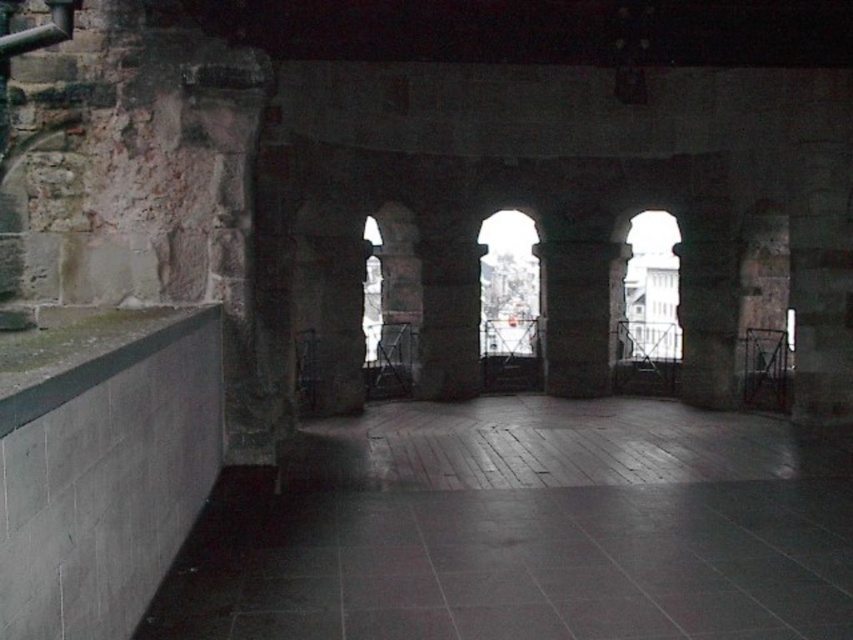
Question: Does dark gray tile floor at lower left have a lesser width compared to smooth stone pillar at center?

Choices:
 (A) no
 (B) yes

Answer: (A)

Question: Is dark gray tile floor at lower left wider than smooth stone pillar at center?

Choices:
 (A) yes
 (B) no

Answer: (A)

Question: Which object is closer to the camera taking this photo?

Choices:
 (A) dark gray tile floor at lower left
 (B) smooth stone pillar at center

Answer: (A)

Question: Can you confirm if dark gray tile floor at lower left is positioned to the left of smooth stone pillar at center?

Choices:
 (A) no
 (B) yes

Answer: (B)

Question: Among these points, which one is nearest to the camera?

Choices:
 (A) (254, 477)
 (B) (570, 392)
 (C) (86, 321)

Answer: (C)

Question: Which point is closer to the camera?

Choices:
 (A) smooth concrete ledge at left
 (B) dark gray tile floor at lower left

Answer: (A)